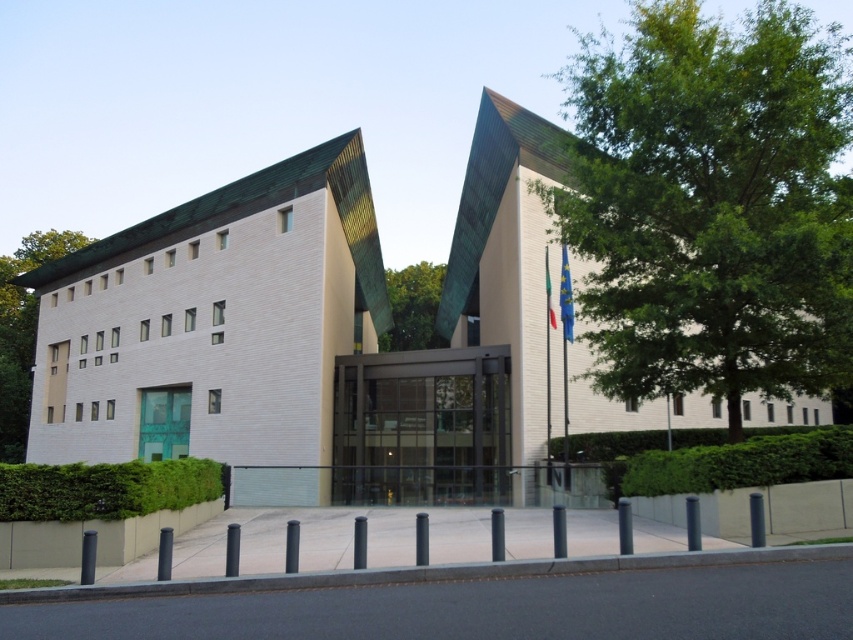
Question: Which object is positioned closest to the green leafy tree at center?

Choices:
 (A) green leafy tree at upper left
 (B) green leafy tree at upper right

Answer: (A)

Question: Can you confirm if green leafy tree at upper right is positioned to the left of green leafy tree at center?

Choices:
 (A) yes
 (B) no

Answer: (B)

Question: Is green leafy tree at upper right thinner than green leafy tree at center?

Choices:
 (A) no
 (B) yes

Answer: (A)

Question: Which point is closer to the camera?

Choices:
 (A) (634, 209)
 (B) (392, 304)

Answer: (A)

Question: From the image, what is the correct spatial relationship of green leafy tree at upper right in relation to green leafy tree at upper left?

Choices:
 (A) left
 (B) right

Answer: (B)

Question: Which of the following is the closest to the observer?

Choices:
 (A) green leafy tree at upper right
 (B) green leafy tree at center
 (C) green leafy tree at upper left

Answer: (A)